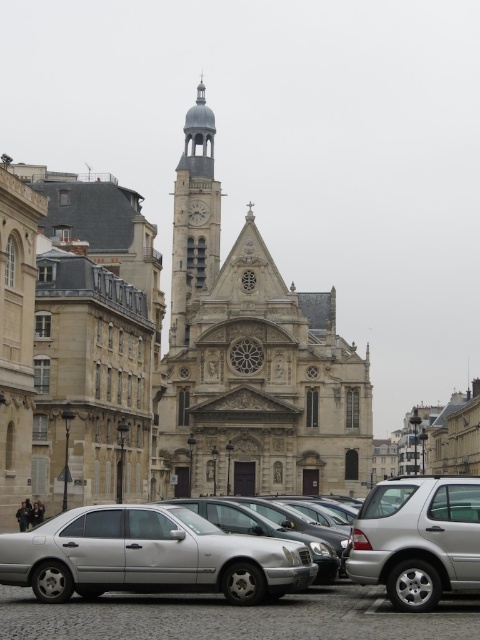
Can you confirm if stone church at center is positioned to the left of silver metallic car at lower right?

Correct, you'll find stone church at center to the left of silver metallic car at lower right.

Which is behind, point (189, 144) or point (471, 502)?

Point (189, 144)

Locate an element on the screen. Image resolution: width=480 pixels, height=640 pixels. stone church at center is located at coordinates (252, 356).

Does point (420, 596) come farther from viewer compared to point (193, 211)?

No, it is in front of (193, 211).

Can you confirm if silver metallic car at lower right is positioned above smooth gray clock tower at upper center?

No.

Locate an element on the screen. This screenshot has height=640, width=480. silver metallic car at lower right is located at coordinates (418, 538).

Which is in front, point (171, 374) or point (271, 577)?

Positioned in front is point (271, 577).

Measure the distance between stone church at center and satin metallic car at lower left.

They are 74.96 meters apart.

Where is `stone church at center`? stone church at center is located at coordinates (252, 356).